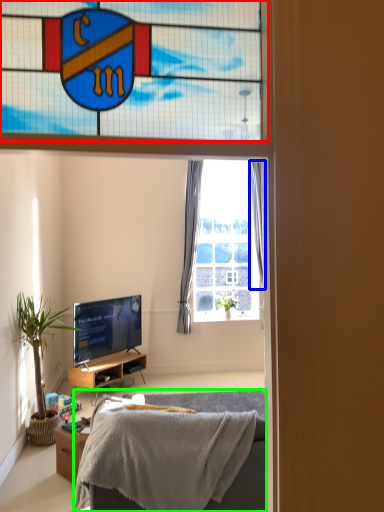
Question: Which object is the closest to the window (highlighted by a red box)? Choose among these: curtain (highlighted by a blue box) or bed (highlighted by a green box).

Choices:
 (A) curtain
 (B) bed

Answer: (A)